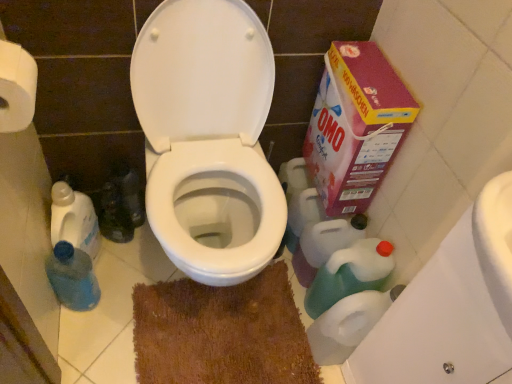
This screenshot has width=512, height=384. In order to click on vacant area that is in front of translucent plastic bottle at lower left, the 3th cleaning product from the right in this screenshot , I will do `click(87, 328)`.